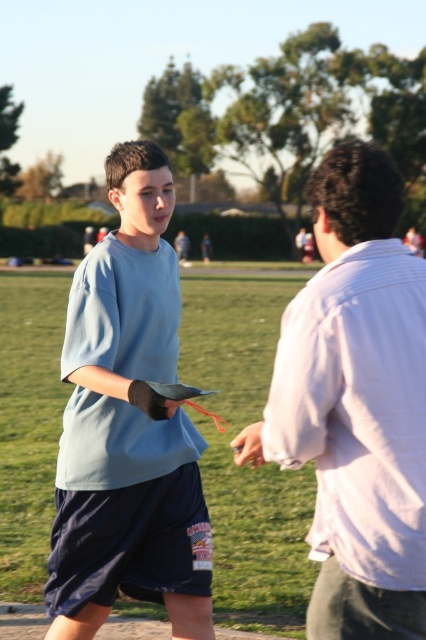
Does light blue t-shirt at center appear over matte black glove at center?

Correct, light blue t-shirt at center is located above matte black glove at center.

Can you confirm if light blue t-shirt at center is wider than matte black glove at center?

Indeed, light blue t-shirt at center has a greater width compared to matte black glove at center.

Who is more forward, (89, 604) or (241, 436)?

Point (241, 436) is more forward.

Where is `light blue t-shirt at center`? The height and width of the screenshot is (640, 426). light blue t-shirt at center is located at coordinates (127, 422).

Who is taller, navy blue shorts at lower left or matte black glove at center?

navy blue shorts at lower left

Is point (192, 577) positioned behind point (259, 442)?

Yes, point (192, 577) is behind point (259, 442).

The width and height of the screenshot is (426, 640). I want to click on navy blue shorts at lower left, so click(129, 544).

Does white striped shirt at right have a smaller size compared to matte black glove at center?

No, white striped shirt at right is not smaller than matte black glove at center.

Which is above, white striped shirt at right or matte black glove at center?

Positioned higher is white striped shirt at right.

Find the location of a particular element. white striped shirt at right is located at coordinates (357, 403).